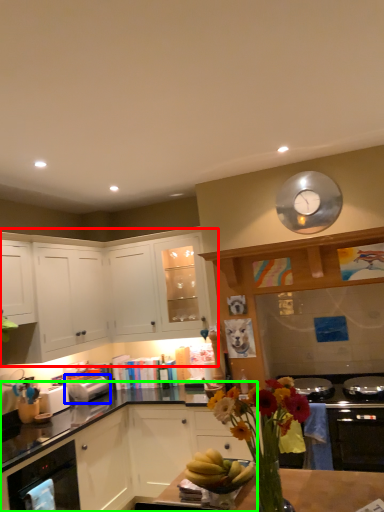
Question: Estimate the real-world distances between objects in this image. Which object is closer to cabinetry (highlighted by a red box), toaster (highlighted by a blue box) or cabinetry (highlighted by a green box)?

Choices:
 (A) toaster
 (B) cabinetry

Answer: (B)